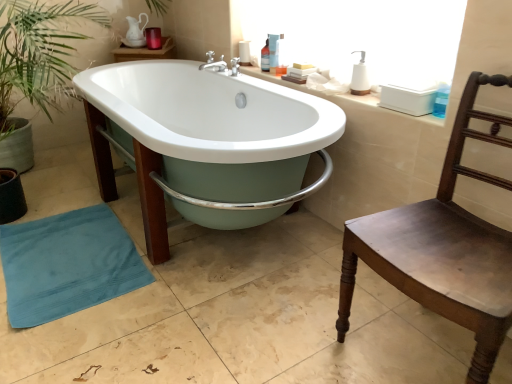
Image resolution: width=512 pixels, height=384 pixels. I want to click on free space that is to the left of white matte soap dispenser at upper right, the 4th toiletry positioned from the back, so click(332, 95).